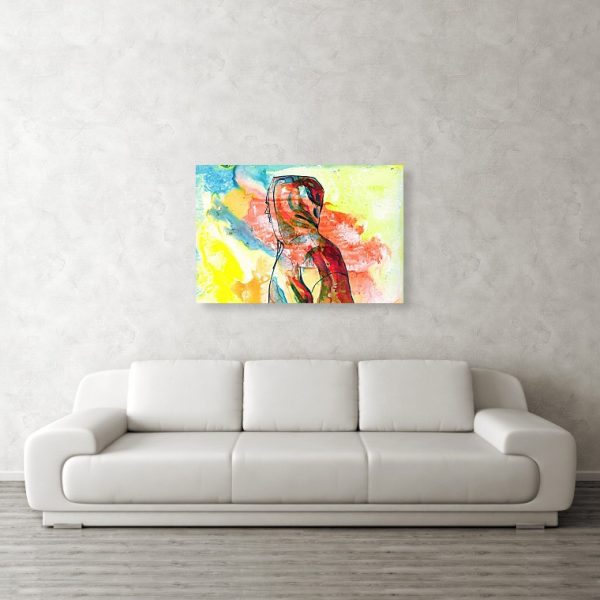
This screenshot has width=600, height=600. Identify the location of artwork. (373, 197).